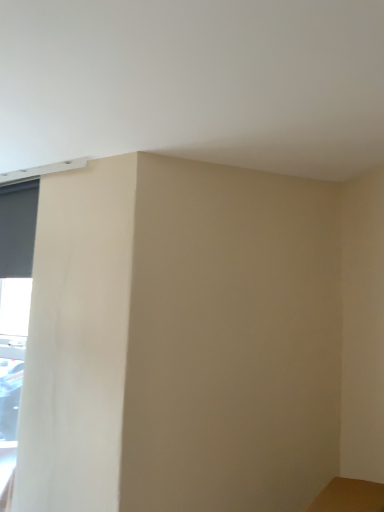
The height and width of the screenshot is (512, 384). Describe the element at coordinates (14, 316) in the screenshot. I see `white matte curtain at left` at that location.

Locate an element on the screen. The width and height of the screenshot is (384, 512). white matte curtain at left is located at coordinates click(14, 316).

Find the location of a particular element. The image size is (384, 512). white matte curtain at left is located at coordinates (14, 316).